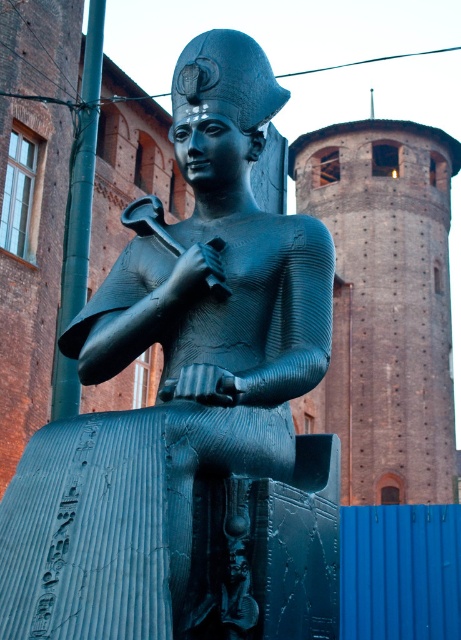
Does bronze statue at center appear over brick tower at upper center?

Incorrect, bronze statue at center is not positioned above brick tower at upper center.

Does bronze statue at center have a greater height compared to brick tower at upper center?

In fact, bronze statue at center may be shorter than brick tower at upper center.

The height and width of the screenshot is (640, 461). I want to click on bronze statue at center, so click(191, 410).

I want to click on bronze statue at center, so click(x=191, y=410).